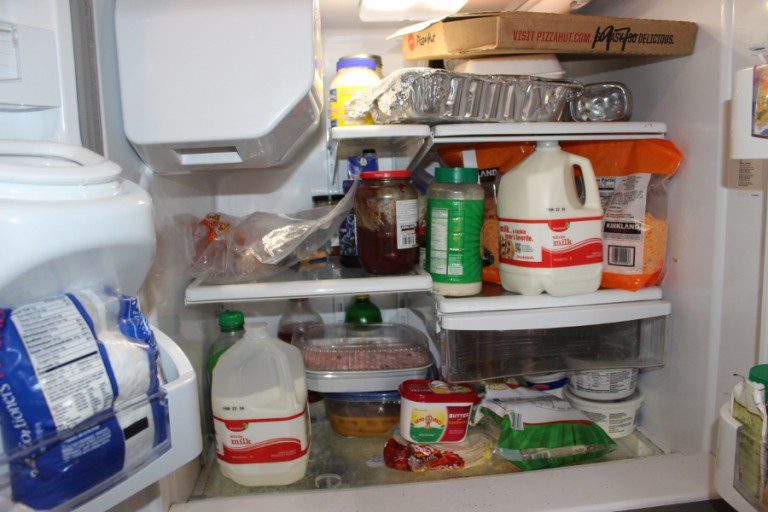
Where is `empty bottle`? The height and width of the screenshot is (512, 768). empty bottle is located at coordinates (608, 102).